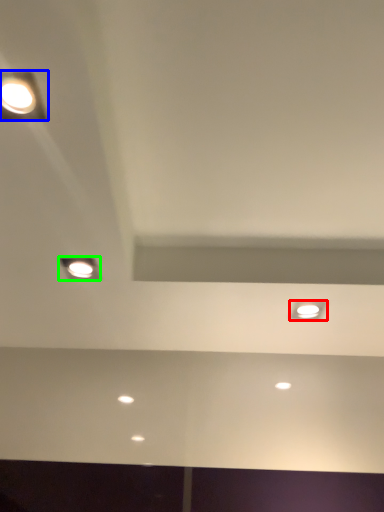
Question: Which object is positioned farthest from dot (highlighted by a red box)? Select from lamp (highlighted by a blue box) and lamp (highlighted by a green box).

Choices:
 (A) lamp
 (B) lamp

Answer: (A)